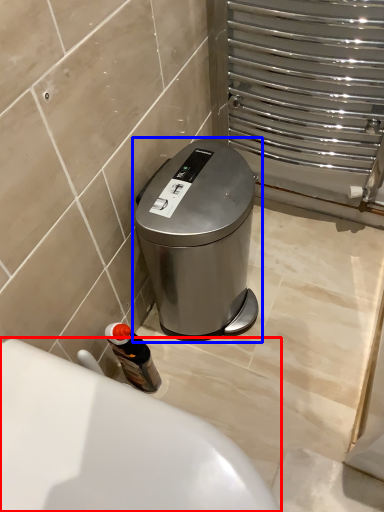
Question: Which object appears farthest to the camera in this image, bath (highlighted by a red box) or waste container (highlighted by a blue box)?

Choices:
 (A) bath
 (B) waste container

Answer: (B)